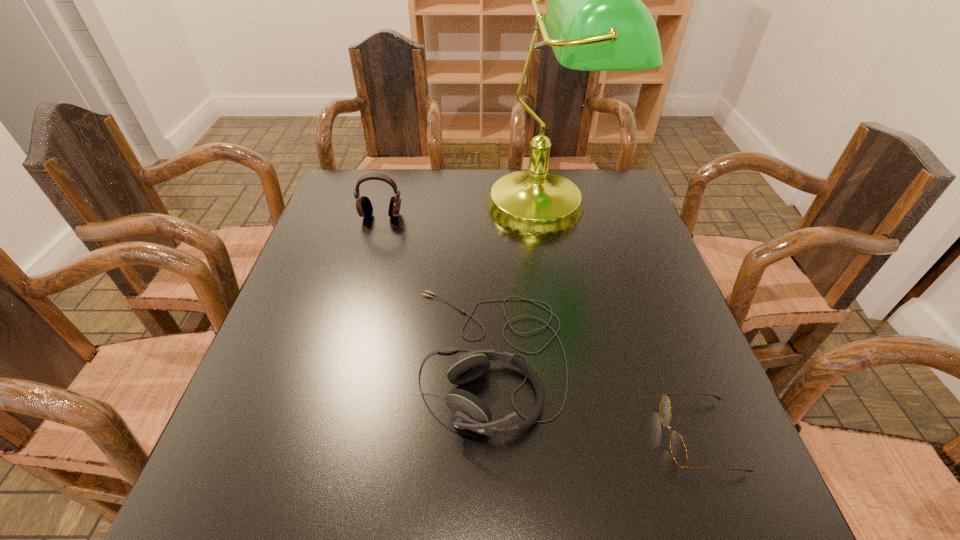
I want to click on the tallest object, so click(x=595, y=21).

Where is `the second tallest object`? the second tallest object is located at coordinates (364, 207).

I want to click on the leftmost object, so click(x=364, y=207).

Identify the location of the second shortest object. The height and width of the screenshot is (540, 960). point(470,412).

At what (x,y) coordinates should I click in order to perform the action: click on the nearer headset. Please return your answer as a coordinate pair (x, y). This screenshot has height=540, width=960. Looking at the image, I should click on (470, 412).

The height and width of the screenshot is (540, 960). In order to click on the shortest object in this screenshot , I will do `click(678, 449)`.

The image size is (960, 540). Identify the location of free space located 0.270m on the desk next to the tallest object. (570, 329).

Locate an element on the screen. Image resolution: width=960 pixels, height=540 pixels. vacant position located 0.080m on the ear pads of the taller headset is located at coordinates (374, 240).

This screenshot has width=960, height=540. Identify the location of vacant space located on the outer surface of the nearer headset. (300, 358).

Identify the location of free region located on the outer surface of the nearer headset. (351, 358).